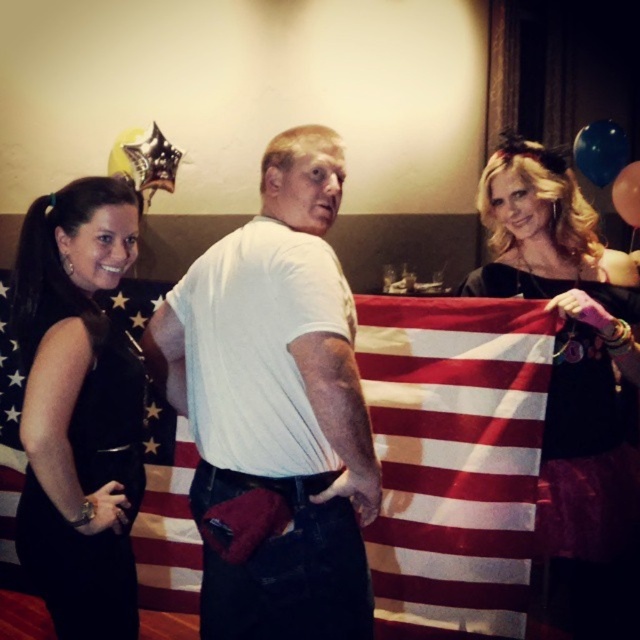
You are a photographer trying to adjust the lighting for a photo. You notice the black dress at left and the blue glossy balloon at upper right. Which object is positioned higher in the frame?

The blue glossy balloon at upper right is positioned higher in the frame than the black dress at left.

Looking at this image, you are a photographer trying to capture a clear shot of both the black tulle skirt at right and the rubber balloon at upper right. Given their sizes, which object might require you to adjust your camera focus more carefully to ensure clarity?

The rubber balloon at upper right is smaller than the black tulle skirt at right, so you might need to adjust the camera focus more carefully to ensure clarity on the smaller object.